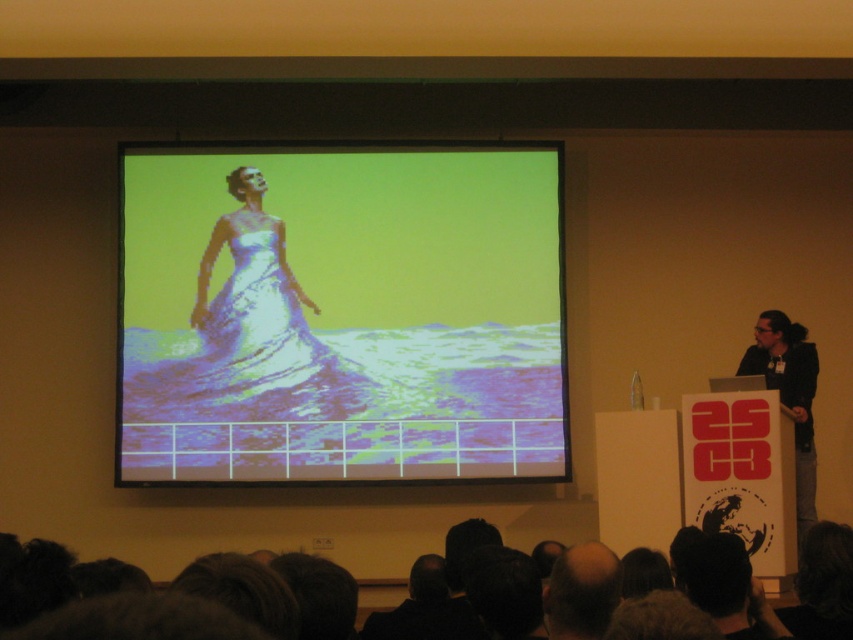
Is white glossy dress at upper center thinner than black fabric at right?

No, white glossy dress at upper center is not thinner than black fabric at right.

Is point (397, 154) farther from camera compared to point (814, 481)?

Yes, it is behind point (814, 481).

Is point (259, 160) positioned in front of point (816, 360)?

No, (259, 160) is further to viewer.

Where is `white glossy dress at upper center`? white glossy dress at upper center is located at coordinates (341, 314).

Can you confirm if white glossy dress at upper center is thinner than bald head at lower center?

No.

Based on the photo, does white glossy dress at upper center appear on the right side of bald head at lower center?

In fact, white glossy dress at upper center is to the left of bald head at lower center.

Image resolution: width=853 pixels, height=640 pixels. In order to click on white glossy dress at upper center in this screenshot , I will do [341, 314].

Is point (340, 323) farther from viewer compared to point (242, 460)?

Yes, point (340, 323) is behind point (242, 460).

Does white glossy dress at upper center have a larger size compared to white glossy dress at center?

Indeed, white glossy dress at upper center has a larger size compared to white glossy dress at center.

Is point (158, 372) positioned in front of point (335, 448)?

No, it is not.

At what (x,y) coordinates should I click in order to perform the action: click on white glossy dress at upper center. Please return your answer as a coordinate pair (x, y). This screenshot has width=853, height=640. Looking at the image, I should click on [x=341, y=314].